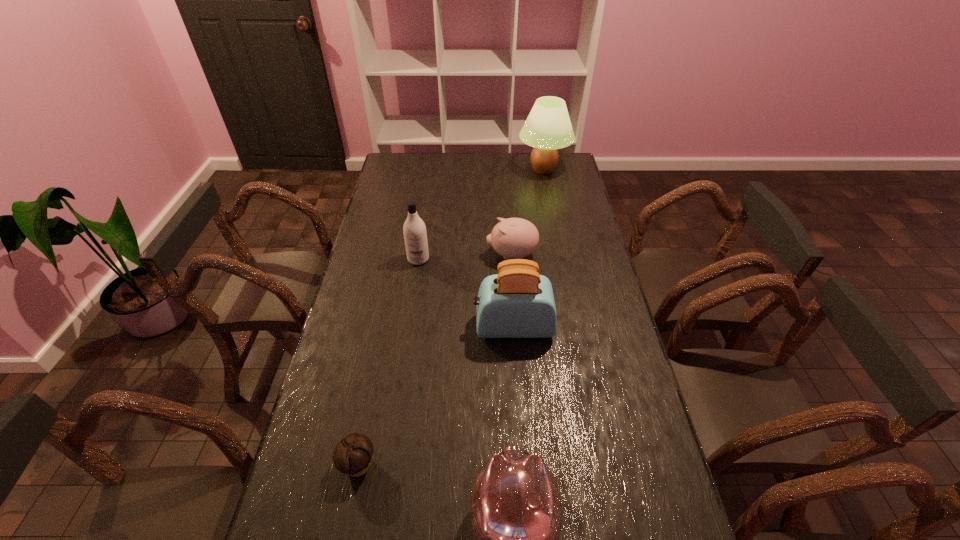
Where is `free space between the shortest object and the shorter piggy bank`? Image resolution: width=960 pixels, height=540 pixels. free space between the shortest object and the shorter piggy bank is located at coordinates (435, 360).

Locate which object ranks fifth in proximity to the nearer piggy bank. Please provide its 2D coordinates. Your answer should be formatted as a tuple, i.e. [(x, y)], where the tuple contains the x and y coordinates of a point satisfying the conditions above.

[(548, 127)]

Find the location of a particular element. The width and height of the screenshot is (960, 540). object that is the fifth closest to the shampoo is located at coordinates (516, 512).

At what (x,y) coordinates should I click in order to perform the action: click on free location that satisfies the following two spatial constraints: 1. on the side of the toaster with the lever; 2. on the front side of the muffin. Please return your answer as a coordinate pair (x, y). Image resolution: width=960 pixels, height=540 pixels. Looking at the image, I should click on (523, 464).

I want to click on free space that satisfies the following two spatial constraints: 1. on the side of the fourth farthest object with the lever; 2. on the front side of the shortest object, so click(x=523, y=464).

Identify the location of free spot that satisfies the following two spatial constraints: 1. at the snout of the shorter piggy bank; 2. on the front-facing side of the shampoo. Image resolution: width=960 pixels, height=540 pixels. (512, 259).

Where is `vacant space that satisfies the following two spatial constraints: 1. on the shade of the farthest object; 2. on the front-facing side of the shampoo`? The image size is (960, 540). vacant space that satisfies the following two spatial constraints: 1. on the shade of the farthest object; 2. on the front-facing side of the shampoo is located at coordinates (561, 259).